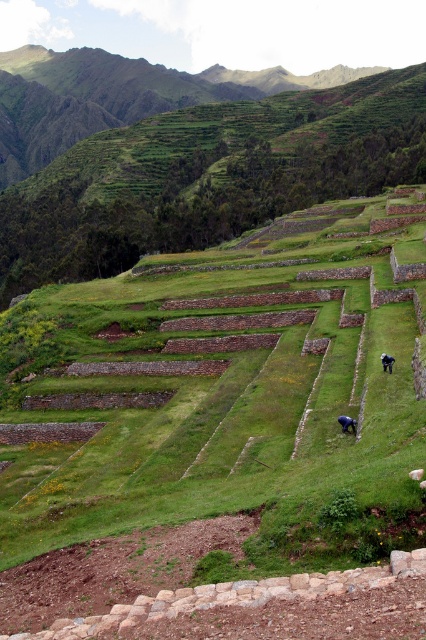
You are a visitor standing at the base of the terraced landscape. You see the blue fabric person at lower right and the black fabric person at lower right working in the same terrace. Which person is closer to your left side?

The blue fabric person at lower right is to the left of the black fabric person at lower right, so the blue fabric person at lower right is closer to your left side.

You are standing at the top of the terraced hillside and want to greet both the blue fabric person at lower right and the black fabric person at lower right. Which person should you approach first if you want to reach the one closer to you first?

You should approach the blue fabric person at lower right first because they are closer to you than the black fabric person at lower right.

You are standing at the base of the terraced mountain and see the blue fabric person at lower right and the black fabric person at lower right working in the field. If you want to walk to both of them, which path would require a shorter distance? Please explain your reasoning.

The blue fabric person at lower right is 27.79 feet away from the black fabric person at lower right. Since both are at the lower right, the path to the closer one would be shorter. However, without knowing which is closer to you, we can only state their distance apart. To determine which is nearer to you, you would need to assess their positions relative to your starting point.